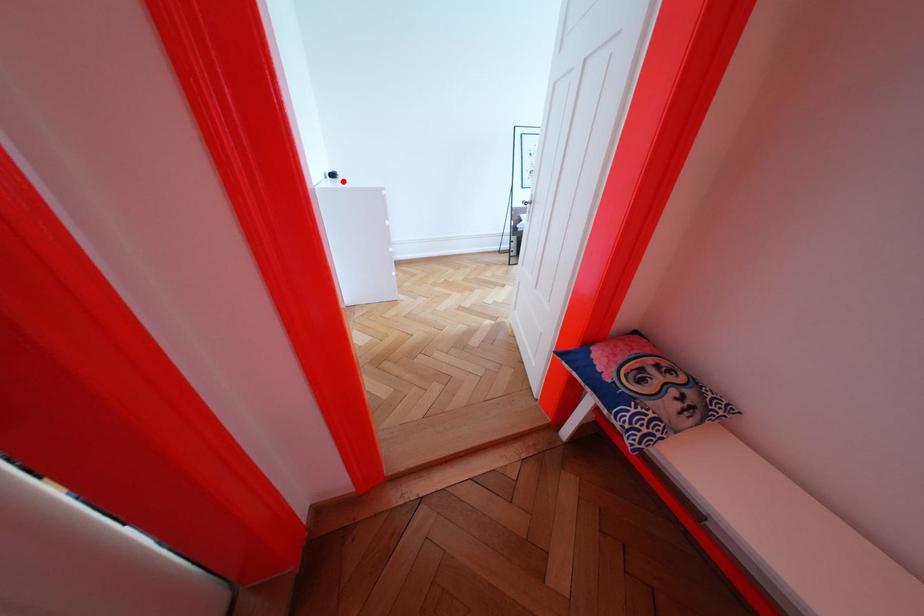
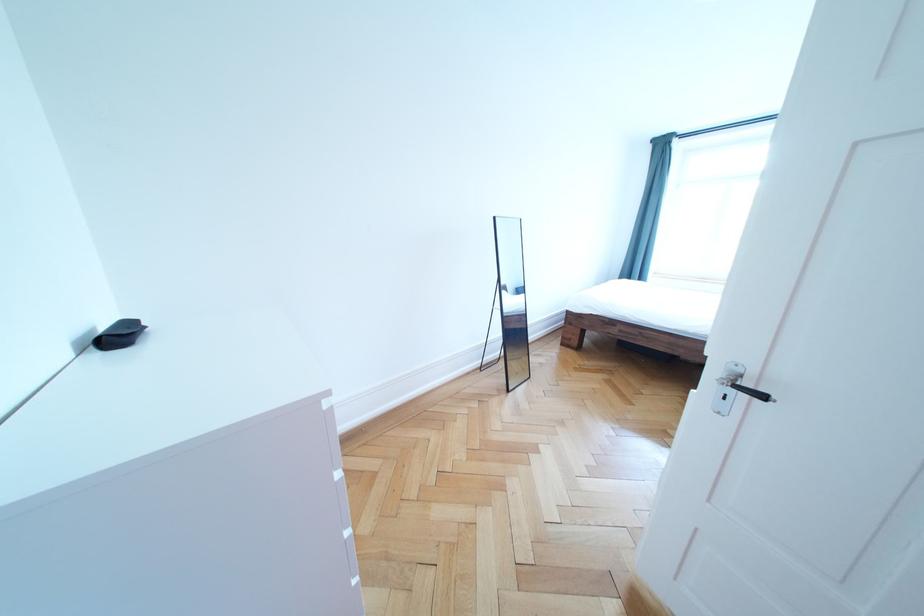
Question: I am providing you with two images of the same scene from different viewpoints. Given a red point in image1, look at the same physical point in image2. Is it:

Choices:
 (A) Closer to the viewpoint
 (B) Farther from the viewpoint

Answer: (B)